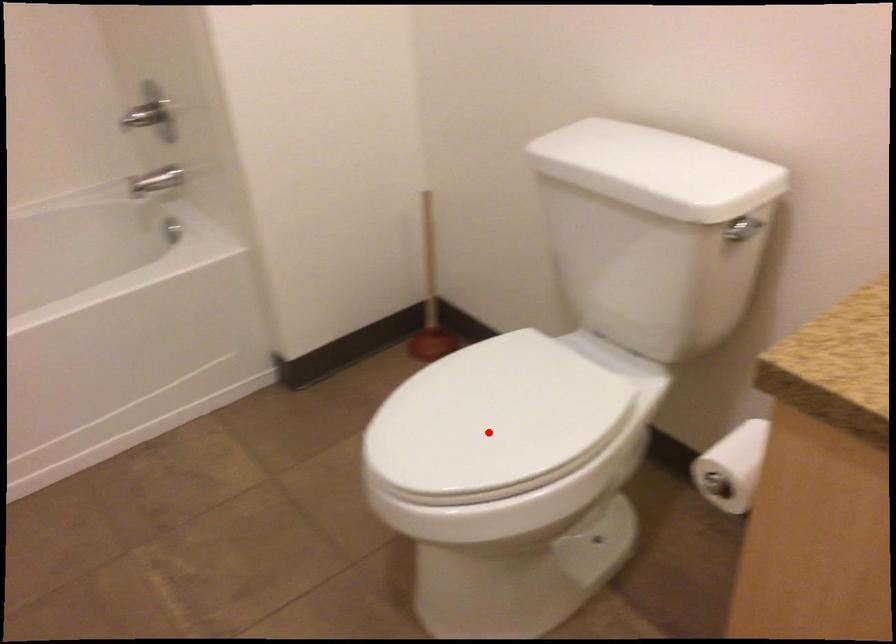
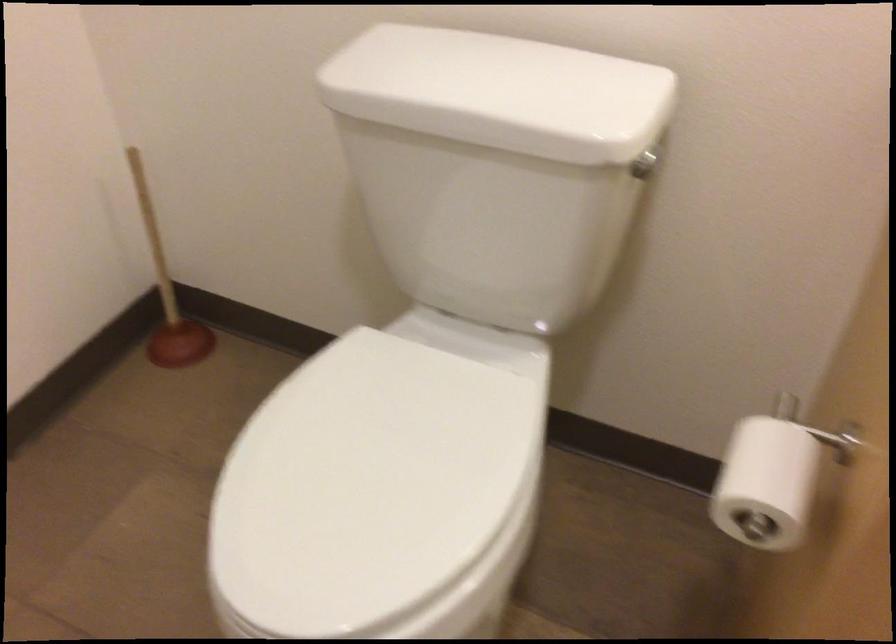
The point at the highlighted location is marked in the first image. Where is the corresponding point in the second image?

(376, 496)